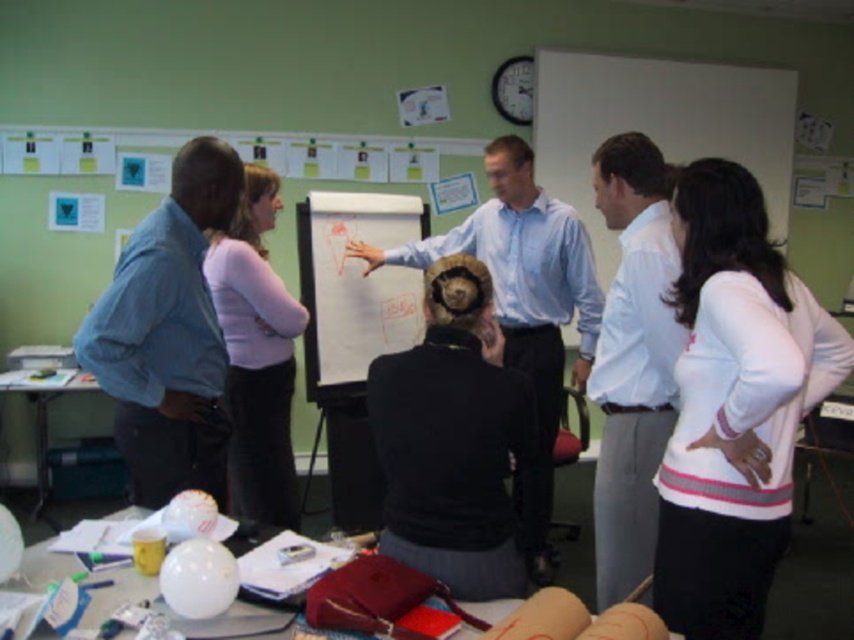
Question: Estimate the real-world distances between objects in this image. Which object is closer to the whiteboard at center?

Choices:
 (A) blue striped shirt at left
 (B) white sweater at right
 (C) light blue shirt at center

Answer: (C)

Question: Considering the real-world distances, which object is closest to the white sweater at right?

Choices:
 (A) light blue shirt at center
 (B) blue striped shirt at left
 (C) light purple sweater at center
 (D) whiteboard at center

Answer: (A)

Question: Is light blue shirt at center to the left of light purple sweater at center from the viewer's perspective?

Choices:
 (A) yes
 (B) no

Answer: (B)

Question: Which point is closer to the camera?

Choices:
 (A) light purple sweater at center
 (B) light blue shirt at center
 (C) white shirt at right
 (D) blue striped shirt at left

Answer: (D)

Question: Is blue striped shirt at left below light blue shirt at center?

Choices:
 (A) yes
 (B) no

Answer: (B)

Question: Is blue striped shirt at left wider than light blue shirt at center?

Choices:
 (A) yes
 (B) no

Answer: (B)